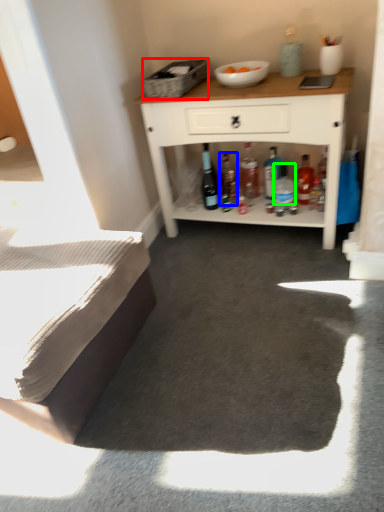
Question: Which object is the closest to the picnic basket (highlighted by a red box)? Choose among these: bottle (highlighted by a blue box) or bottle (highlighted by a green box).

Choices:
 (A) bottle
 (B) bottle

Answer: (A)